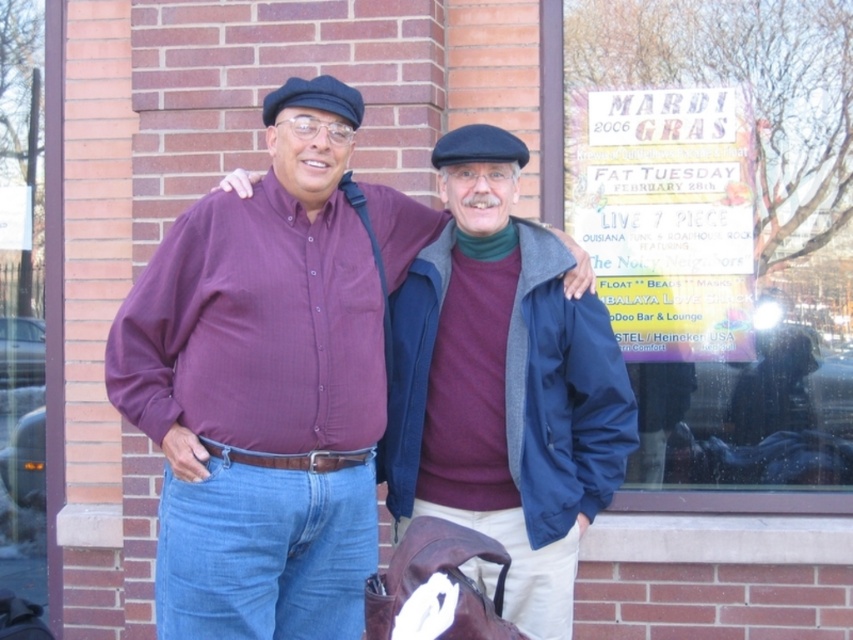
Please describe the clothing of the person whose position is marked by point [262,388] in the image. Use the scene description to help you.

The person at point [262,388] is wearing a matte purple shirt.